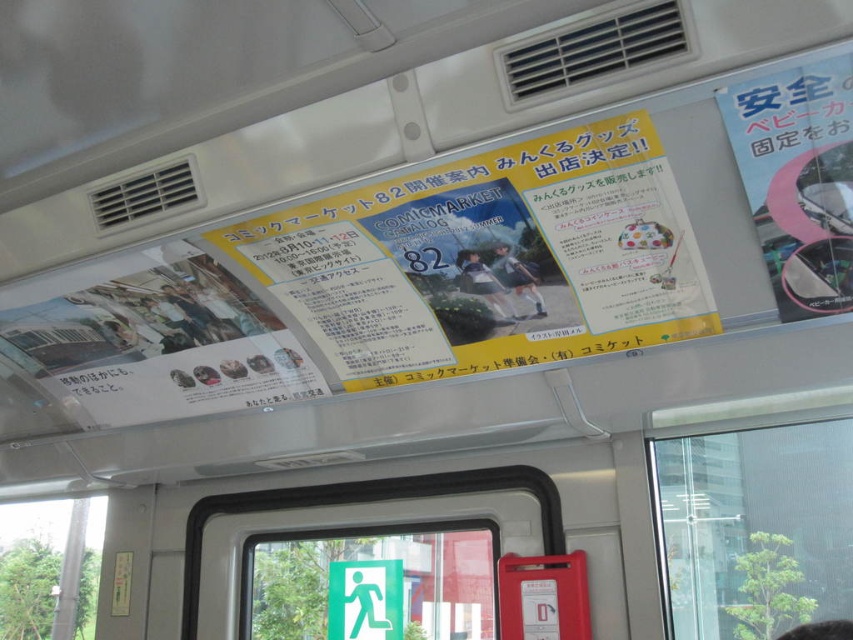
Does green glossy exit sign at center appear on the right side of white paper poster at upper right?

Incorrect, green glossy exit sign at center is not on the right side of white paper poster at upper right.

Between green glossy exit sign at center and white paper poster at upper right, which one appears on the right side from the viewer's perspective?

white paper poster at upper right is more to the right.

Find the location of a particular element. This screenshot has width=853, height=640. green glossy exit sign at center is located at coordinates (375, 586).

Is point (318, 257) less distant than point (664, 493)?

Yes, point (318, 257) is in front of point (664, 493).

Does point (631, 284) come farther from viewer compared to point (721, 442)?

No, it is in front of (721, 442).

Identify the location of yellow paper poster at upper center. (383, 285).

At what (x,y) coordinates should I click in order to perform the action: click on yellow paper poster at upper center. Please return your answer as a coordinate pair (x, y). The image size is (853, 640). Looking at the image, I should click on (383, 285).

Between white paper poster at upper right and transparent glass window at lower left, which one has less height?

With less height is white paper poster at upper right.

Can you confirm if white paper poster at upper right is wider than transparent glass window at lower left?

No, white paper poster at upper right is not wider than transparent glass window at lower left.

The width and height of the screenshot is (853, 640). Find the location of `white paper poster at upper right`. white paper poster at upper right is located at coordinates point(798,180).

The height and width of the screenshot is (640, 853). I want to click on white paper poster at upper right, so click(x=798, y=180).